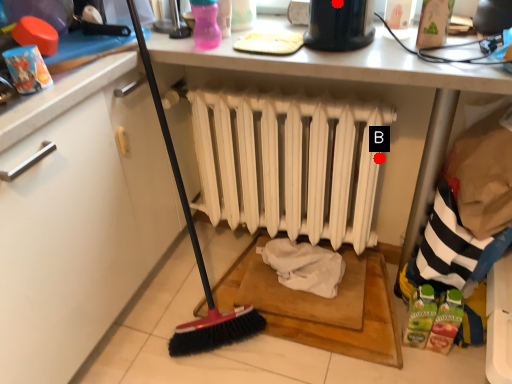
Question: Two points are circled on the image, labeled by A and B beside each circle. Which point appears farthest from the camera in this image?

Choices:
 (A) A is further
 (B) B is further

Answer: (B)